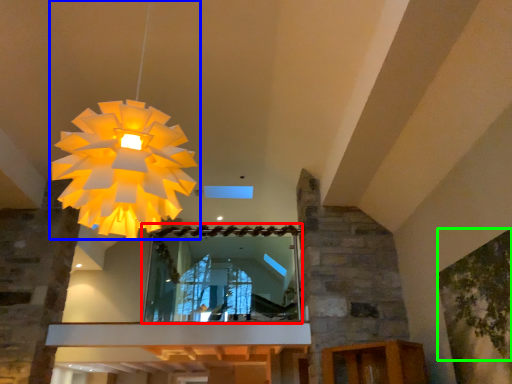
Question: Which object is the farthest from mirror (highlighted by a red box)? Choose among these: lamp (highlighted by a blue box) or tree (highlighted by a green box).

Choices:
 (A) lamp
 (B) tree

Answer: (A)